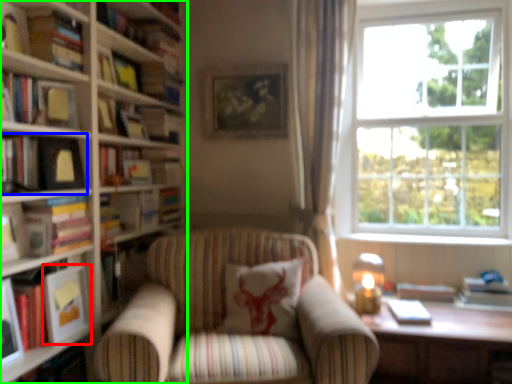
Question: Which is nearer to the paperback book (highlighted by a red box)? book (highlighted by a blue box) or book (highlighted by a green box).

Choices:
 (A) book
 (B) book

Answer: (B)